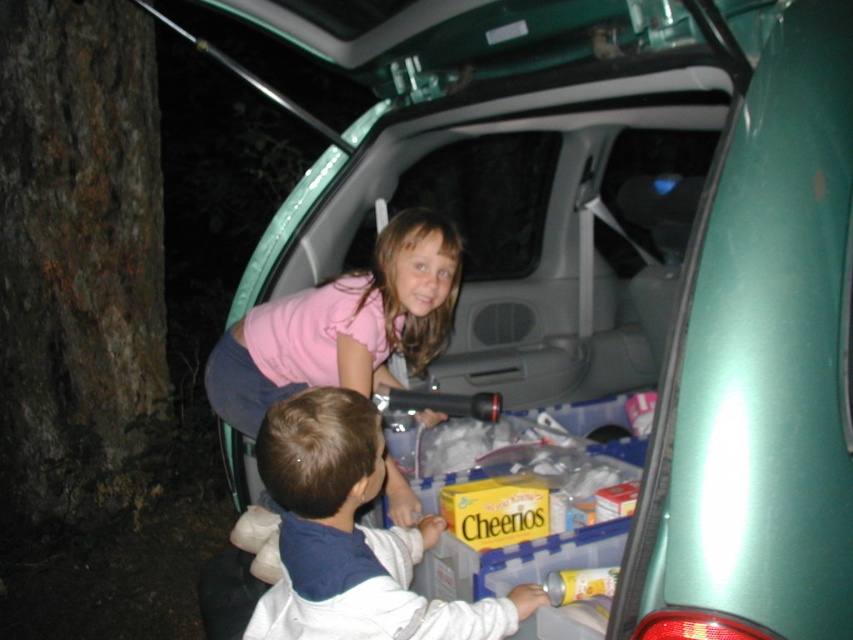
You are a parent trying to retrieve a toy from the trunk of the green vehicle. You notice the white fleece jacket at lower center and the pink fabric shirt at center in your way. Which item should you move first to access the toy?

You should move the white fleece jacket at lower center first because it is closer to you than the pink fabric shirt at center, making it easier to reach.

From the picture: You are trying to decide which clothing item to grab first from the trunk. Based on their positions, which item is closer to you? The white fleece jacket at lower center or the pink fabric shirt at center?

The white fleece jacket at lower center is closer to you because it is positioned lower than the pink fabric shirt at center, which is higher up.